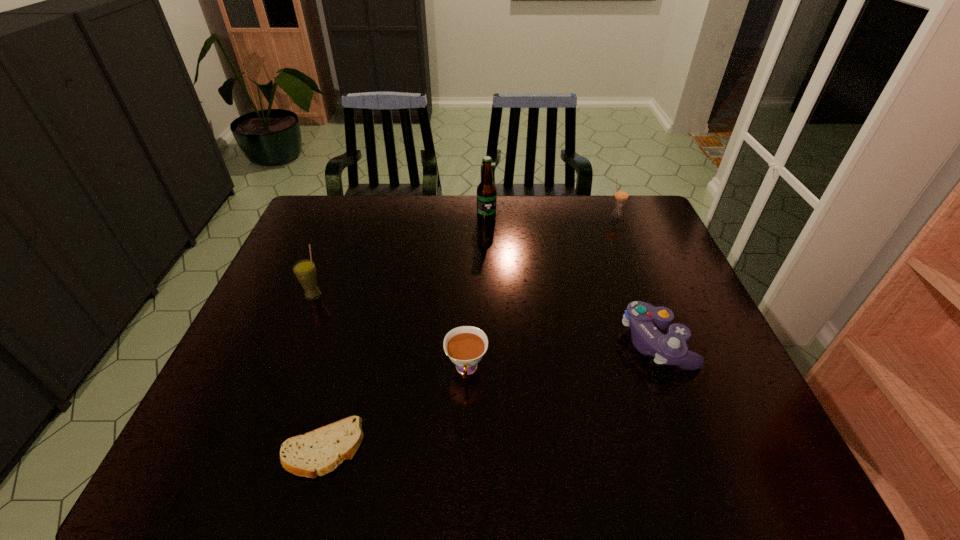
Where is `beer bottle`? The image size is (960, 540). beer bottle is located at coordinates (486, 191).

You are a GUI agent. You are given a task and a screenshot of the screen. Output one action in this format:
    pyautogui.click(x=<x>, y=<y>)
    Task: Click on the taller straw
    
    Given the screenshot: What is the action you would take?
    pyautogui.click(x=305, y=271)

At what (x,y) coordinates should I click in order to perform the action: click on the left straw. Please return your answer as a coordinate pair (x, y). This screenshot has width=960, height=540. Looking at the image, I should click on (305, 271).

Identify the location of the shorter straw. (621, 194).

The height and width of the screenshot is (540, 960). I want to click on the farther straw, so click(x=621, y=194).

Find the location of a particular element. Image resolution: width=960 pixels, height=540 pixels. control is located at coordinates (643, 318).

At what (x,y) coordinates should I click in order to perform the action: click on teacup. Please return your answer as a coordinate pair (x, y). This screenshot has width=960, height=540. Looking at the image, I should click on (466, 345).

Locate an element on the screen. The width and height of the screenshot is (960, 540). the nearest object is located at coordinates (318, 452).

Find the location of a particular element. the second object from left to right is located at coordinates (318, 452).

Find the location of a particular element. The width and height of the screenshot is (960, 540). vacant area located 0.250m on the label of the tallest object is located at coordinates (488, 272).